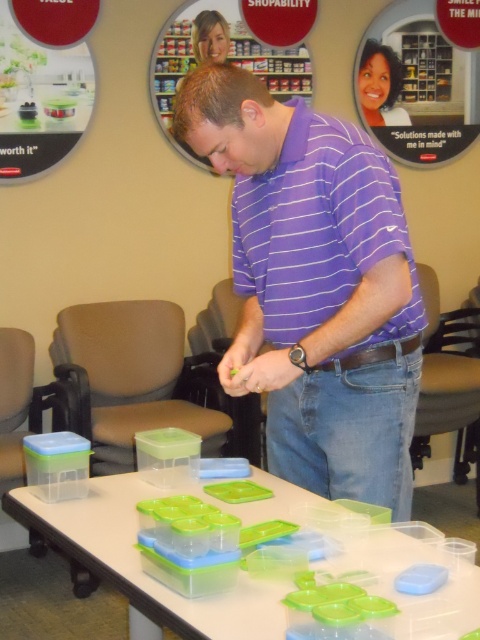
Question: Which of the following is the closest to the observer?

Choices:
 (A) clear plastic containers at center
 (B) purple striped shirt at center

Answer: (A)

Question: Is purple striped shirt at center to the right of clear plastic containers at center from the viewer's perspective?

Choices:
 (A) no
 (B) yes

Answer: (B)

Question: Is purple striped shirt at center bigger than clear plastic containers at center?

Choices:
 (A) yes
 (B) no

Answer: (A)

Question: Can you confirm if purple striped shirt at center is thinner than clear plastic containers at center?

Choices:
 (A) yes
 (B) no

Answer: (A)